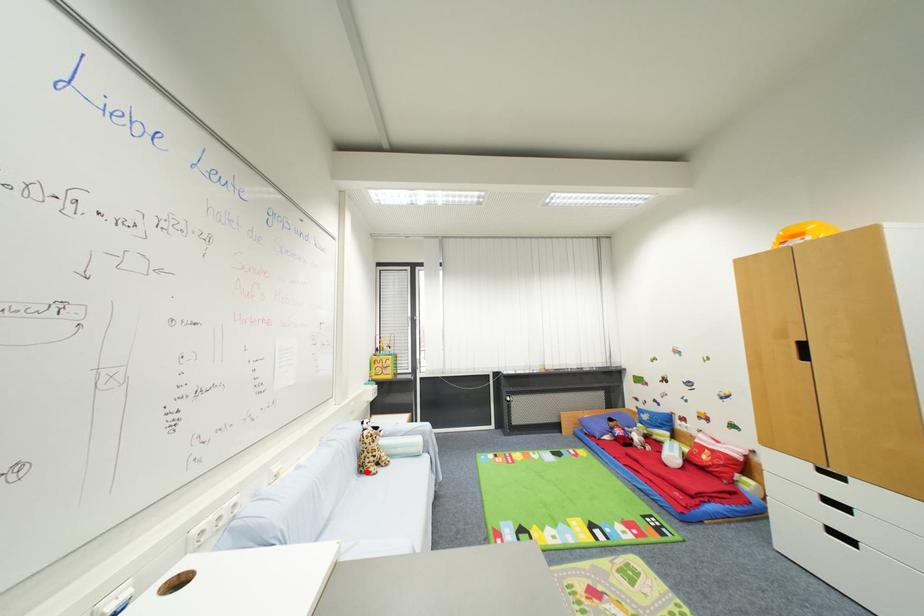
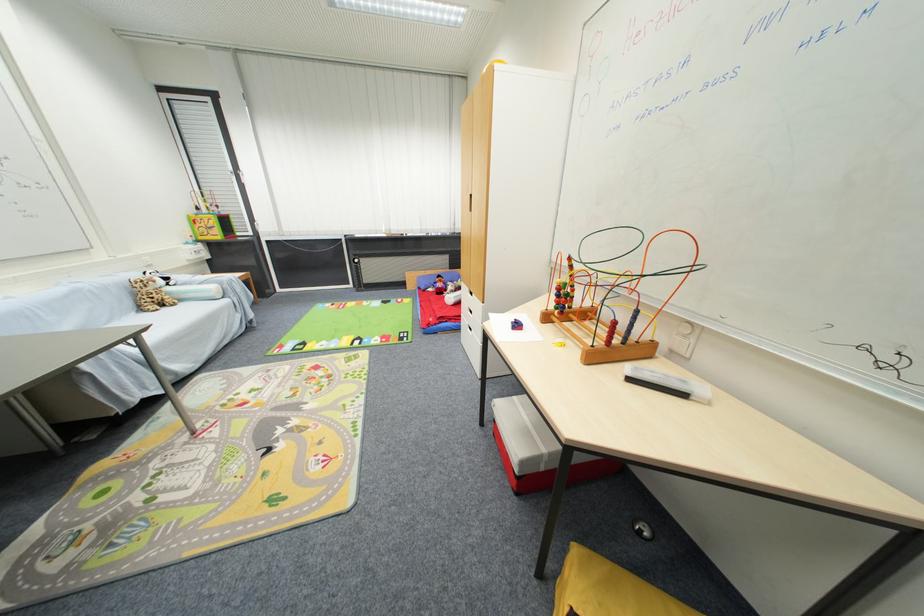
The point at the highlighted location is marked in the first image. Where is the corresponding point in the second image?

(146, 310)